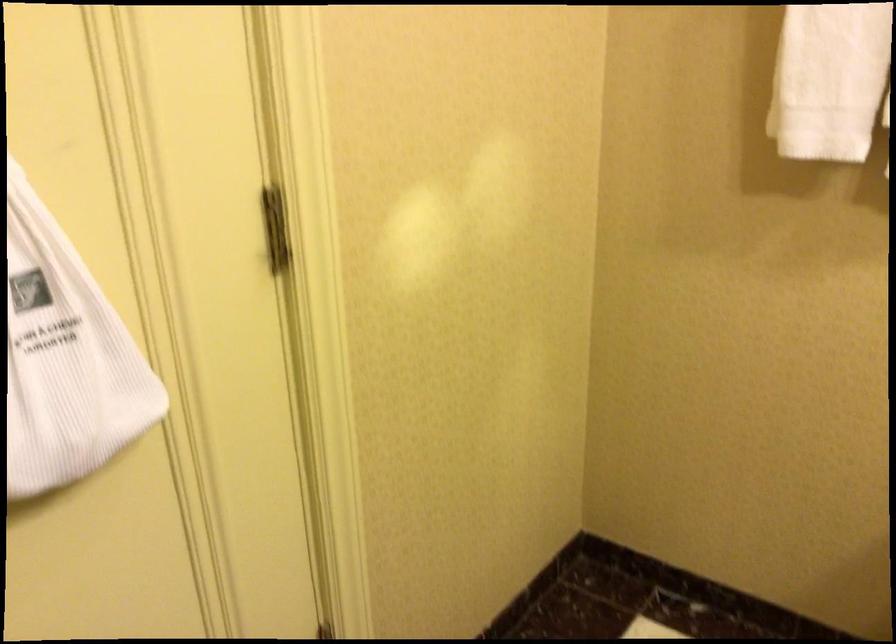
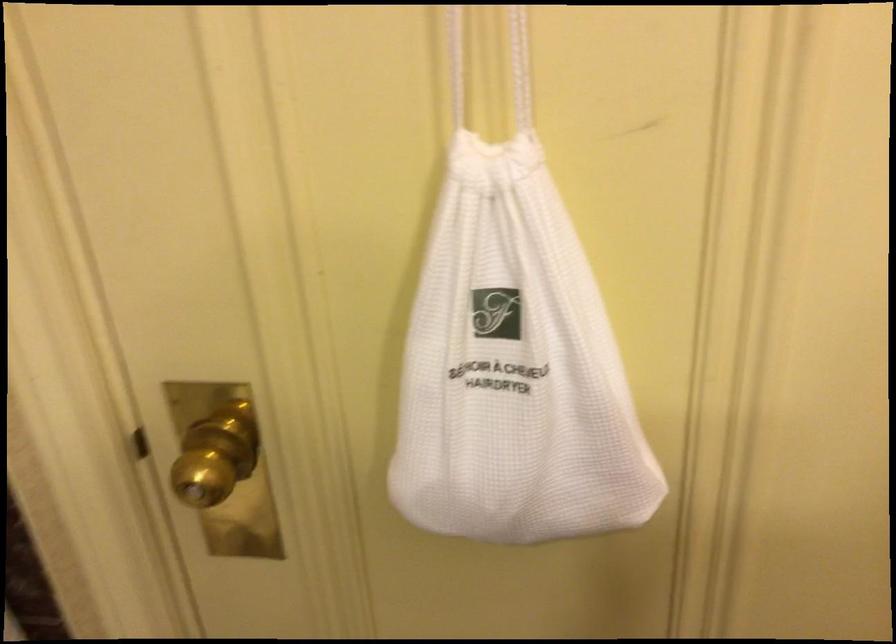
From the picture: First-person continuous shooting, in which direction is the camera rotating?

The camera rotated toward left-down.